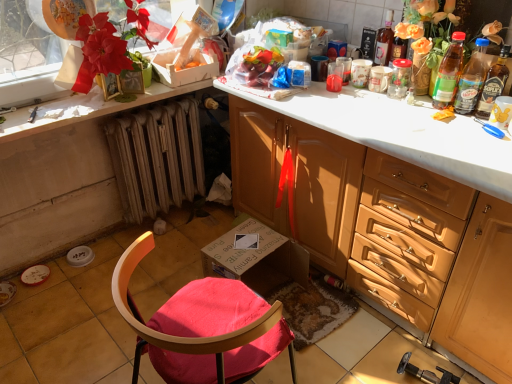
Locate an element on the screen. Image resolution: width=512 pixels, height=384 pixels. blank space to the left of translucent plastic bottle at upper right, which appears as the second bottle when viewed from the left is located at coordinates (413, 99).